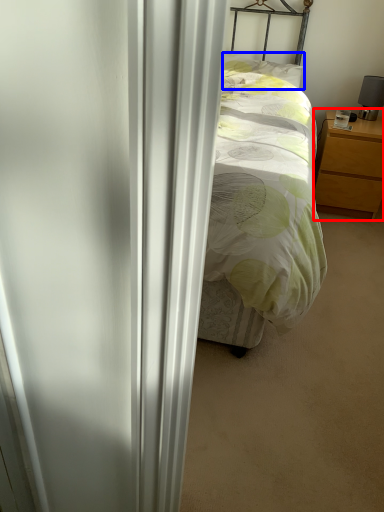
Question: Which object appears farthest to the camera in this image, nightstand (highlighted by a red box) or pillow (highlighted by a blue box)?

Choices:
 (A) nightstand
 (B) pillow

Answer: (B)